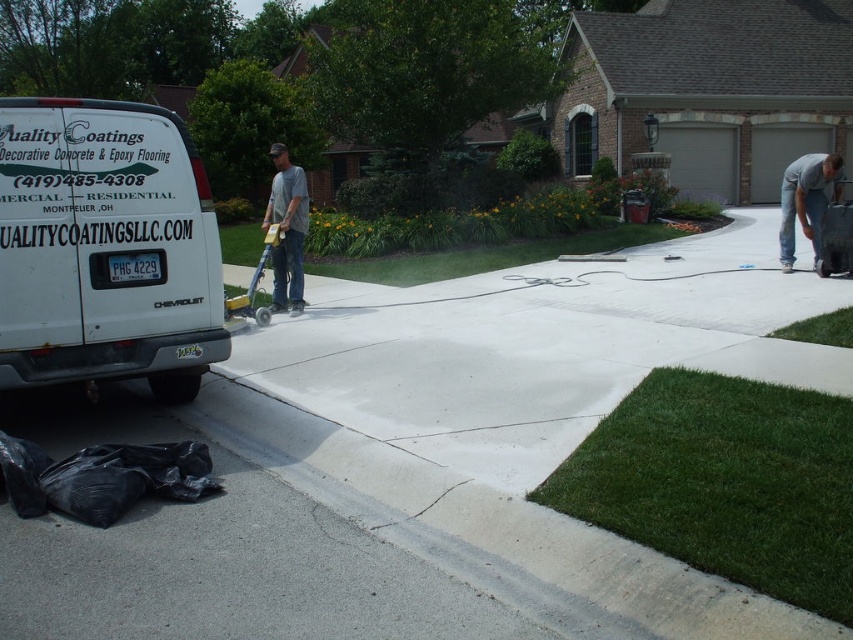
Is point (155, 280) positioned behind point (834, 180)?

No, (155, 280) is closer to viewer.

Looking at this image, can you confirm if white matte van at left is bigger than gray cotton shirt at upper right?

Incorrect, white matte van at left is not larger than gray cotton shirt at upper right.

Is point (44, 189) more distant than point (828, 173)?

No, (44, 189) is closer to viewer.

In order to click on white matte van at left in this screenshot , I will do `click(105, 248)`.

Which is above, white matte van at left or gray matte t-shirt at center?

Positioned higher is gray matte t-shirt at center.

Based on the photo, can you confirm if white matte van at left is thinner than gray matte t-shirt at center?

Yes.

Locate an element on the screen. Image resolution: width=853 pixels, height=640 pixels. white matte van at left is located at coordinates (105, 248).

Identify the location of white matte van at left. The image size is (853, 640). (105, 248).

Can you confirm if smooth concrete driveway at center is positioned to the left of gray cotton shirt at upper right?

Correct, you'll find smooth concrete driveway at center to the left of gray cotton shirt at upper right.

Can you confirm if smooth concrete driveway at center is shorter than gray cotton shirt at upper right?

Indeed, smooth concrete driveway at center has a lesser height compared to gray cotton shirt at upper right.

Is point (708, 259) positioned in front of point (828, 176)?

No, it is not.

At what (x,y) coordinates should I click in order to perform the action: click on smooth concrete driveway at center. Please return your answer as a coordinate pair (x, y). The width and height of the screenshot is (853, 640). Looking at the image, I should click on (427, 460).